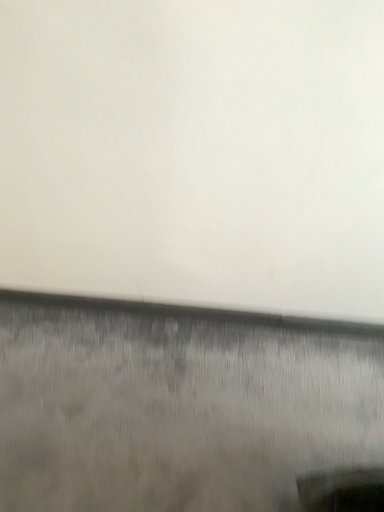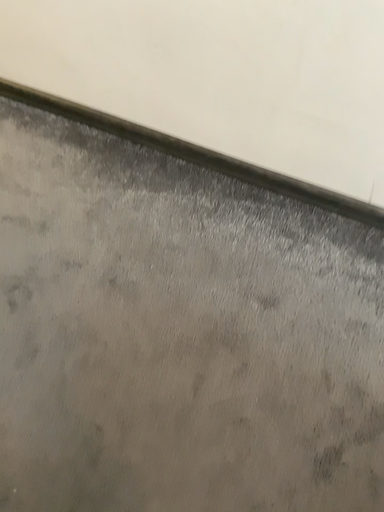
Question: Which way did the camera rotate in the video?

Choices:
 (A) rotated right
 (B) rotated left

Answer: (B)